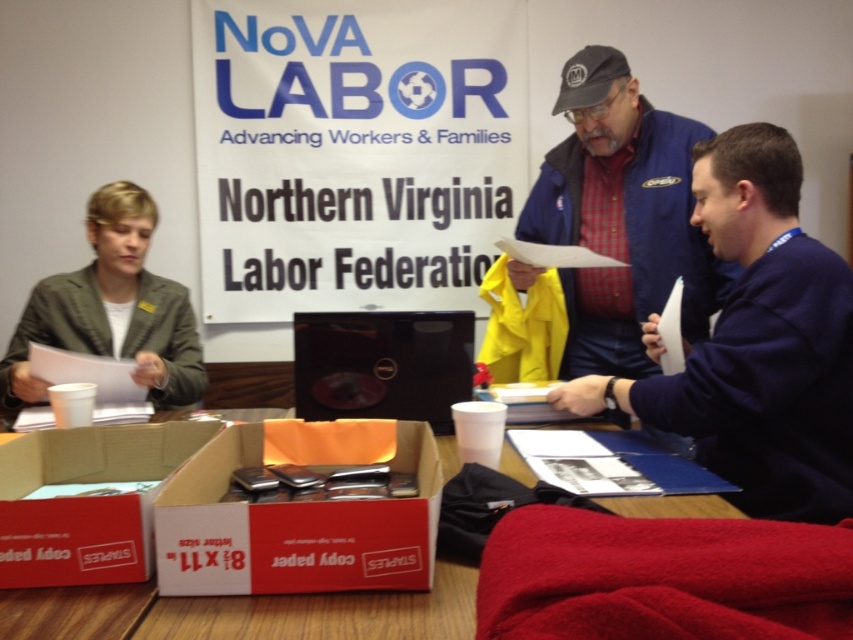
Question: Among these objects, which one is farthest from the camera?

Choices:
 (A) white cardboard box at lower center
 (B) white cardboard box at lower left
 (C) blue jacket at center

Answer: (C)

Question: Is dark blue sweater at center to the right of white cardboard box at center from the viewer's perspective?

Choices:
 (A) no
 (B) yes

Answer: (B)

Question: Can you confirm if white cardboard box at center is positioned below green fabric jacket at left?

Choices:
 (A) no
 (B) yes

Answer: (B)

Question: In this image, where is blue jacket at center located relative to green fabric jacket at left?

Choices:
 (A) left
 (B) right

Answer: (B)

Question: Which point appears closest to the camera in this image?

Choices:
 (A) (102, 586)
 (B) (103, 332)
 (C) (62, 445)

Answer: (A)

Question: Estimate the real-world distances between objects in this image. Which object is farther from the white cardboard box at center?

Choices:
 (A) blue jacket at center
 (B) white cardboard box at lower left

Answer: (A)